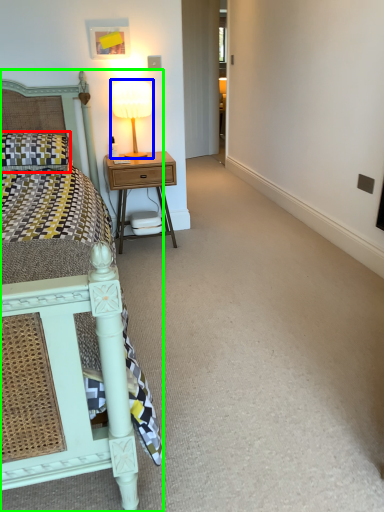
Question: Which is farther away from pillow (highlighted by a red box)? bedside lamp (highlighted by a blue box) or bed (highlighted by a green box)?

Choices:
 (A) bedside lamp
 (B) bed

Answer: (B)